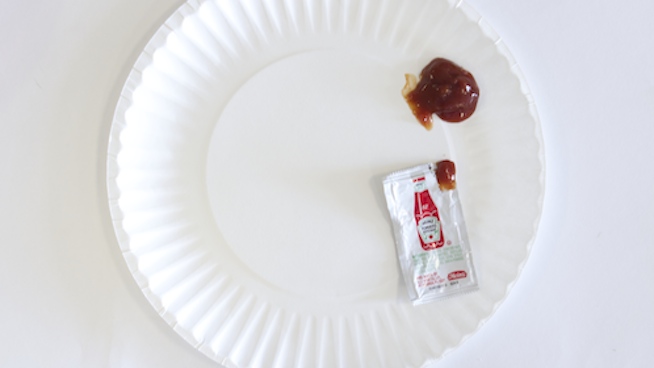
Locate an element on the screen. white paper plate is located at coordinates (292, 210).